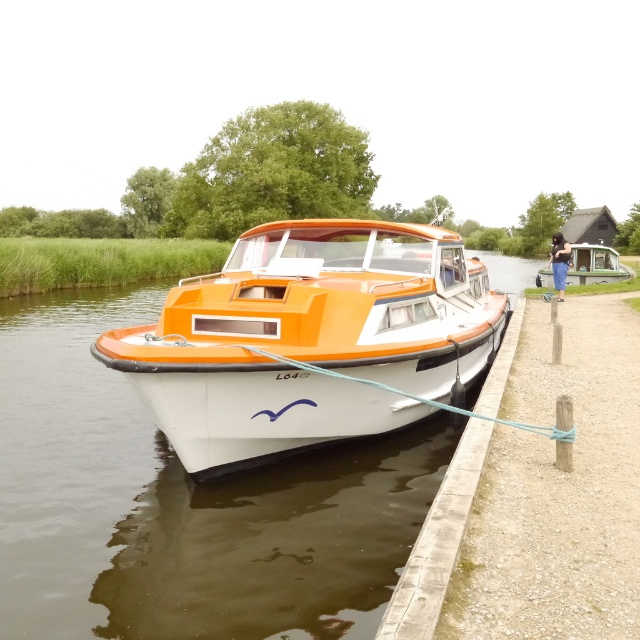
Question: Does orange matte boat at center have a lesser width compared to green matte boat at right?

Choices:
 (A) no
 (B) yes

Answer: (B)

Question: Among these points, which one is nearest to the camera?

Choices:
 (A) (378, 333)
 (B) (579, 275)

Answer: (A)

Question: Does orange matte boat at center appear on the right side of green matte boat at right?

Choices:
 (A) yes
 (B) no

Answer: (B)

Question: Can you confirm if orange matte boat at center is bigger than green matte boat at right?

Choices:
 (A) no
 (B) yes

Answer: (A)